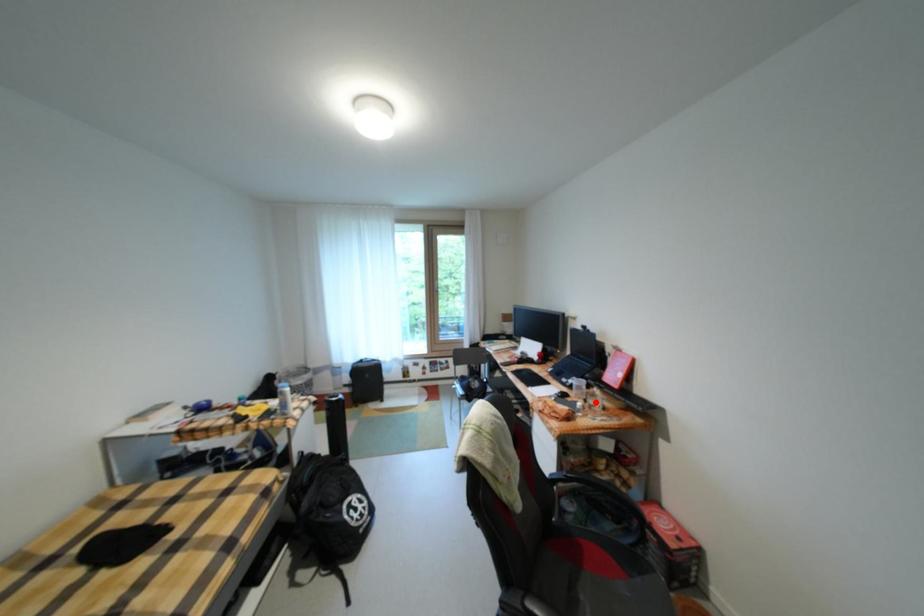
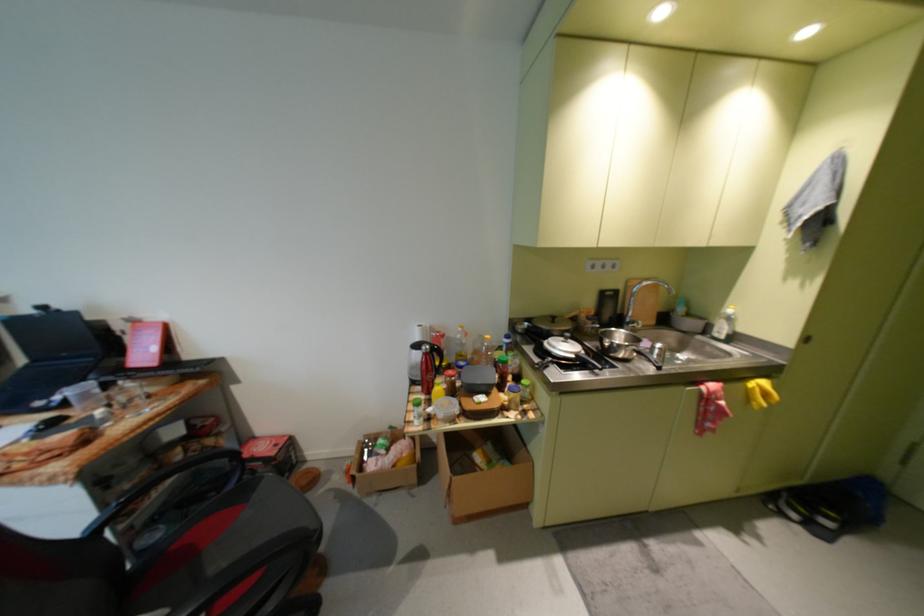
Question: I am providing you with two images of the same scene from different viewpoints. A red point is marked on the first image. Can you still see the location of the red point in image 2?

Choices:
 (A) Yes
 (B) No

Answer: (A)